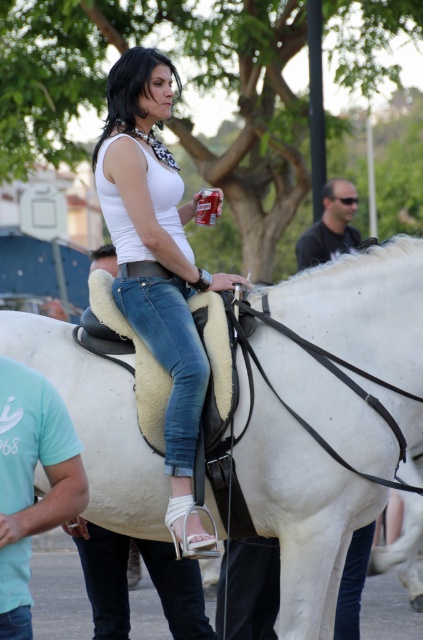
Question: Which point is farther to the camera?

Choices:
 (A) (313, 241)
 (B) (326, 320)
 (C) (80, 499)

Answer: (A)

Question: Observing the image, what is the correct spatial positioning of white leather saddle at upper center in reference to light blue t-shirt at lower left?

Choices:
 (A) below
 (B) above

Answer: (B)

Question: Which point is closer to the camera?

Choices:
 (A) white matte tank top at center
 (B) white leather saddle at upper center
 (C) matte black shirt at upper right
 (D) light blue t-shirt at lower left

Answer: (D)

Question: Does white leather saddle at upper center appear over matte black shirt at upper right?

Choices:
 (A) no
 (B) yes

Answer: (A)

Question: Among these points, which one is nearest to the camera?

Choices:
 (A) (19, 337)
 (B) (101, 211)
 (C) (2, 528)
 (D) (337, 243)

Answer: (C)

Question: Does white matte tank top at center appear on the right side of matte black shirt at upper right?

Choices:
 (A) yes
 (B) no

Answer: (B)